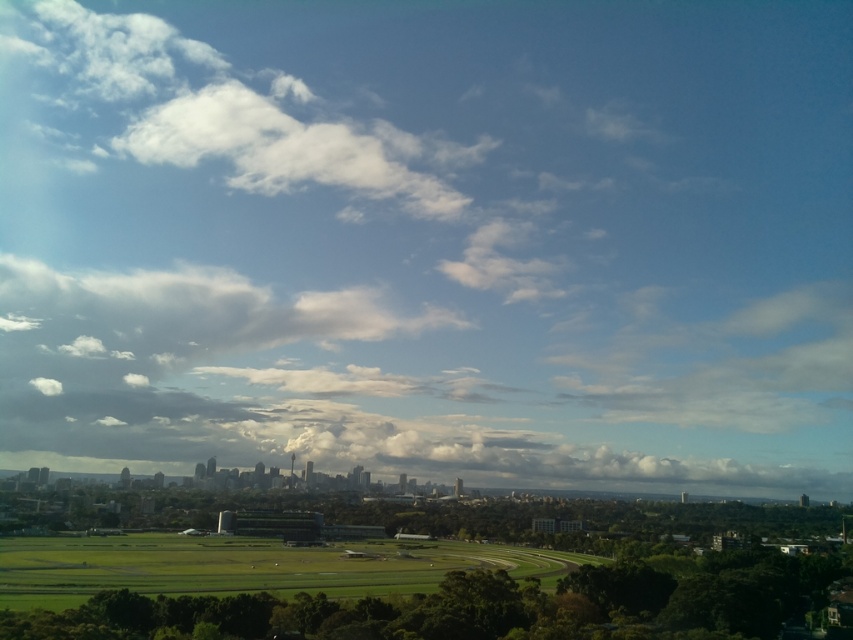
Question: Can you confirm if white fluffy cloud at upper left is positioned below green grassy field at center?

Choices:
 (A) yes
 (B) no

Answer: (B)

Question: Which point is closer to the camera?

Choices:
 (A) green grassy field at center
 (B) white fluffy cloud at upper left

Answer: (A)

Question: Among these objects, which one is nearest to the camera?

Choices:
 (A) white fluffy cloud at upper left
 (B) green grassy field at center

Answer: (B)

Question: Is white fluffy cloud at upper left wider than green grassy field at center?

Choices:
 (A) yes
 (B) no

Answer: (B)

Question: Which point appears closest to the camera in this image?

Choices:
 (A) (84, 346)
 (B) (225, 557)

Answer: (B)

Question: Does white fluffy cloud at upper left have a smaller size compared to green grassy field at center?

Choices:
 (A) no
 (B) yes

Answer: (B)